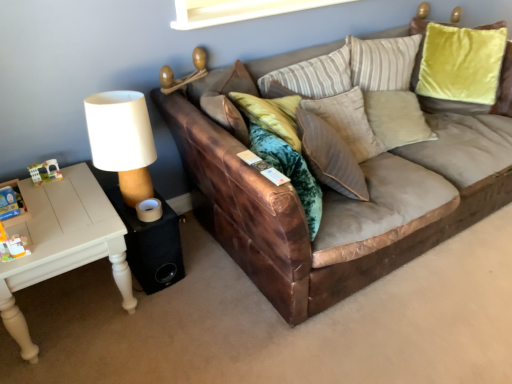
Locate an element on the screen. The width and height of the screenshot is (512, 384). vacant region to the right of white painted wood table at left is located at coordinates (188, 314).